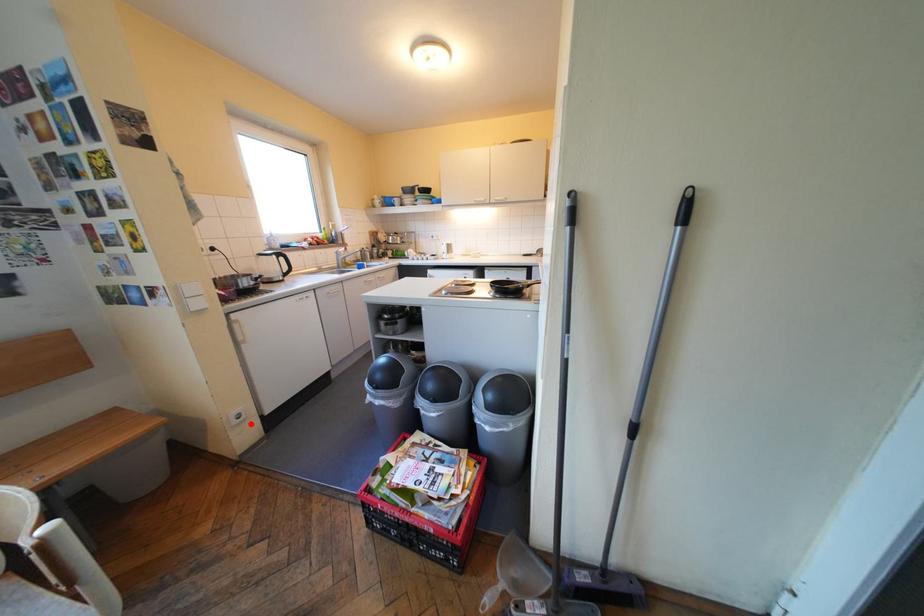
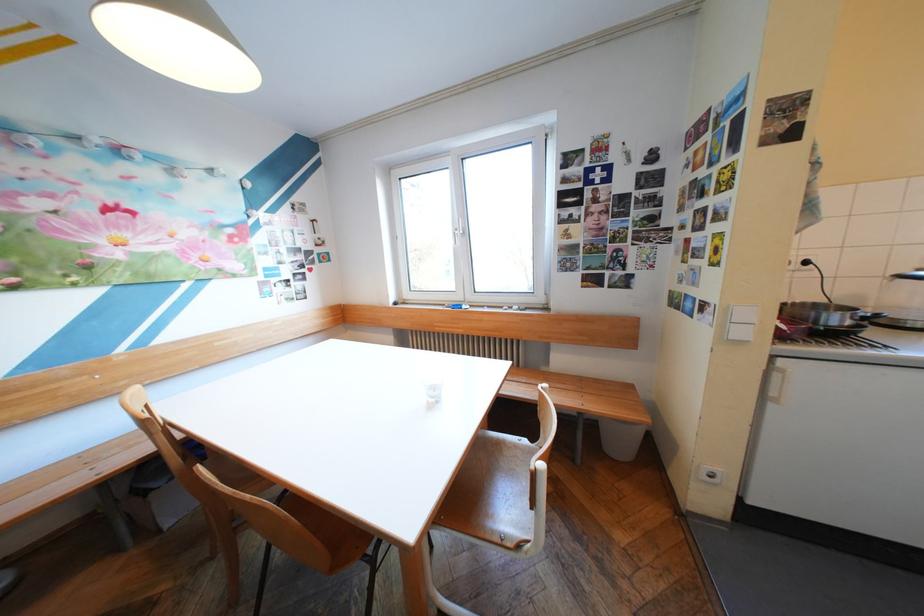
Question: I am providing you with two images of the same scene from different viewpoints. Image1 has a red point marked. In image2, the corresponding 3D location appears at what relative position? Reply with the corresponding letter.

Choices:
 (A) Closer
 (B) Farther

Answer: (B)